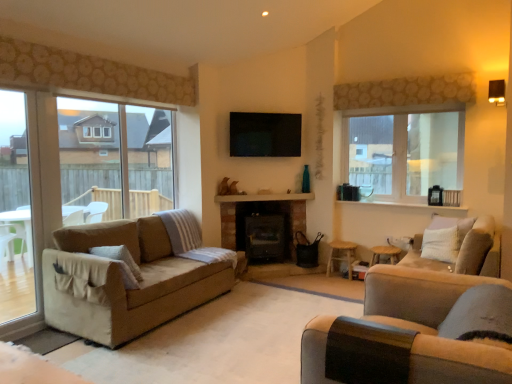
Question: From the image's perspective, would you say beige fabric couch at right is shown under beige fabric couch at lower right, marked as the 2th studio couch in a right-to-left arrangement?

Choices:
 (A) yes
 (B) no

Answer: (B)

Question: Can you confirm if beige fabric couch at right is wider than beige fabric couch at lower right, marked as the 2th studio couch in a right-to-left arrangement?

Choices:
 (A) no
 (B) yes

Answer: (A)

Question: Is beige fabric couch at right thinner than beige fabric couch at lower right, marked as the second studio couch in a back-to-front arrangement?

Choices:
 (A) yes
 (B) no

Answer: (A)

Question: Does beige fabric couch at right have a larger size compared to beige fabric couch at lower right, which is counted as the 1th studio couch, starting from the front?

Choices:
 (A) yes
 (B) no

Answer: (B)

Question: Can you confirm if beige fabric couch at right is smaller than beige fabric couch at lower right, marked as the second studio couch in a back-to-front arrangement?

Choices:
 (A) no
 (B) yes

Answer: (B)

Question: Considering the relative positions of clear glass window at upper right, the 1th window in the right-to-left sequence, and light beige fabric couch at right, the 2th studio couch when ordered from left to right, in the image provided, is clear glass window at upper right, the 1th window in the right-to-left sequence, to the left or to the right of light beige fabric couch at right, the 2th studio couch when ordered from left to right,?

Choices:
 (A) left
 (B) right

Answer: (A)

Question: From the image's perspective, relative to light beige fabric couch at right, the 1th studio couch from the back, is clear glass window at upper right, the second window in the left-to-right sequence, above or below?

Choices:
 (A) below
 (B) above

Answer: (B)

Question: Is clear glass window at upper right, the 1th window in the right-to-left sequence, situated inside light beige fabric couch at right, the 2th studio couch when ordered from left to right, or outside?

Choices:
 (A) inside
 (B) outside

Answer: (B)

Question: Is point (459, 150) positioned closer to the camera than point (470, 231)?

Choices:
 (A) closer
 (B) farther

Answer: (B)

Question: In the image, is beige fabric couch at right positioned in front of or behind clear glass window at left, which is counted as the second window, starting from the right?

Choices:
 (A) front
 (B) behind

Answer: (A)

Question: Does point (376, 281) appear closer or farther from the camera than point (38, 216)?

Choices:
 (A) farther
 (B) closer

Answer: (B)

Question: Is beige fabric couch at right inside the boundaries of clear glass window at left, which ranks as the first window in left-to-right order, or outside?

Choices:
 (A) outside
 (B) inside

Answer: (A)

Question: Based on their sizes in the image, would you say beige fabric couch at right is bigger or smaller than clear glass window at left, which ranks as the first window in left-to-right order?

Choices:
 (A) big
 (B) small

Answer: (A)

Question: Does point (216, 200) appear closer or farther from the camera than point (327, 269)?

Choices:
 (A) closer
 (B) farther

Answer: (A)

Question: Which is correct: brick fireplace at center is inside wooden stool at center, the second stool in the right-to-left sequence, or outside of it?

Choices:
 (A) inside
 (B) outside

Answer: (B)